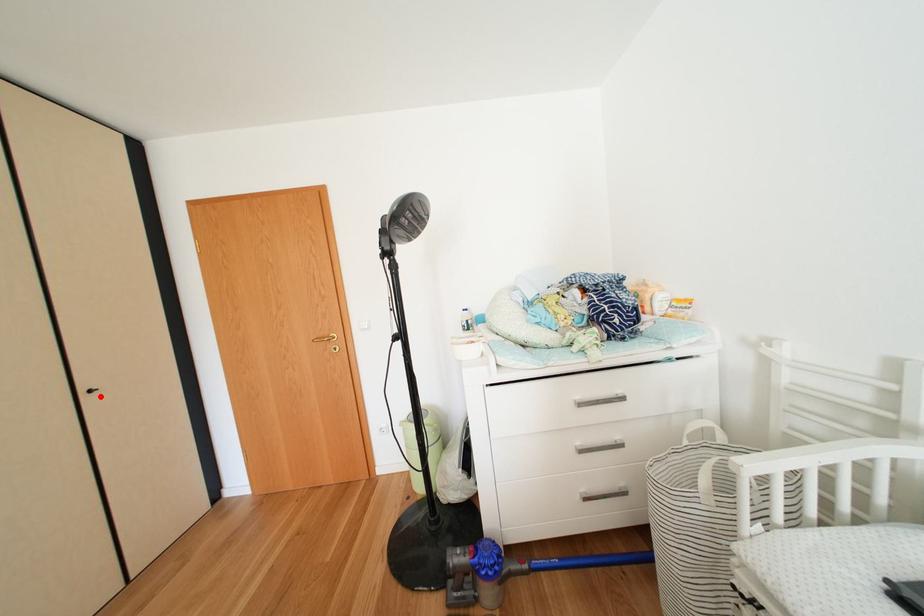
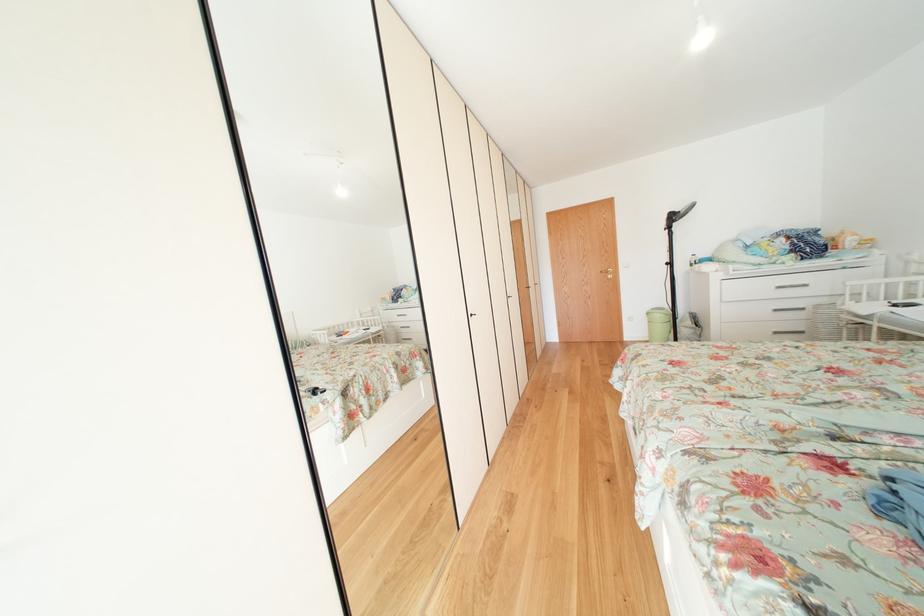
Question: I am providing you with two images of the same scene from different viewpoints. A red point is marked on the first image. At the location where the point appears in image 1, is it still visible in image 2?

Choices:
 (A) Yes
 (B) No

Answer: (B)